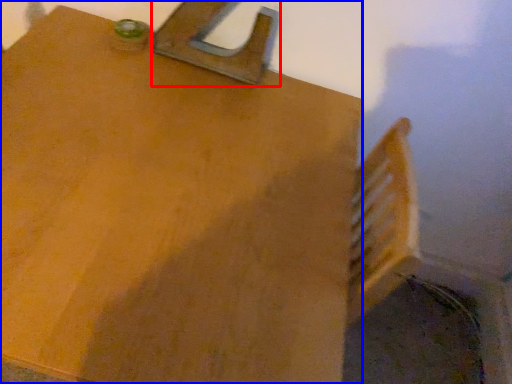
Question: Which point is closer to the camera, latch (highlighted by a red box) or table (highlighted by a blue box)?

Choices:
 (A) latch
 (B) table

Answer: (B)